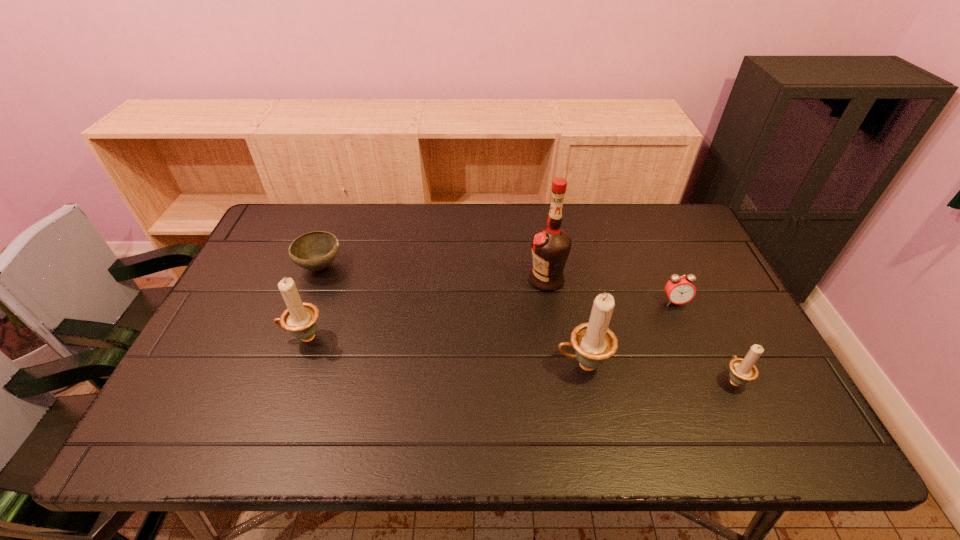
At what (x,y) coordinates should I click in order to perform the action: click on vacant position located on the front and back of the liquor. Please return your answer as a coordinate pair (x, y). The image size is (960, 540). Looking at the image, I should click on (457, 280).

I want to click on blank area located on the left of the bowl, so click(264, 267).

Find the location of a particular element. object that is positioned at the left edge is located at coordinates pos(316,250).

The image size is (960, 540). I want to click on candle_holder that is at the right edge, so click(743, 370).

Find the location of a particular element. alarm clock that is positioned at the right edge is located at coordinates (679, 289).

You are a GUI agent. You are given a task and a screenshot of the screen. Output one action in this format:
    pyautogui.click(x=<x>, y=<y>)
    Task: Click on the object that is at the near right corner
    
    Given the screenshot: What is the action you would take?
    pyautogui.click(x=743, y=370)

At what (x,y) coordinates should I click in order to perform the action: click on free space at the far edge. Please return your answer as a coordinate pair (x, y). Image resolution: width=960 pixels, height=540 pixels. Looking at the image, I should click on (458, 241).

Find the location of a particular element. free region at the near edge of the desktop is located at coordinates (363, 405).

You are a GUI agent. You are given a task and a screenshot of the screen. Output one action in this format:
    pyautogui.click(x=<x>, y=<y>)
    Task: Click on the vacant space at the left edge of the desktop
    This screenshot has width=960, height=540.
    Given the screenshot: What is the action you would take?
    pyautogui.click(x=238, y=328)

Where is `vacant space at the right edge`? The width and height of the screenshot is (960, 540). vacant space at the right edge is located at coordinates (693, 330).